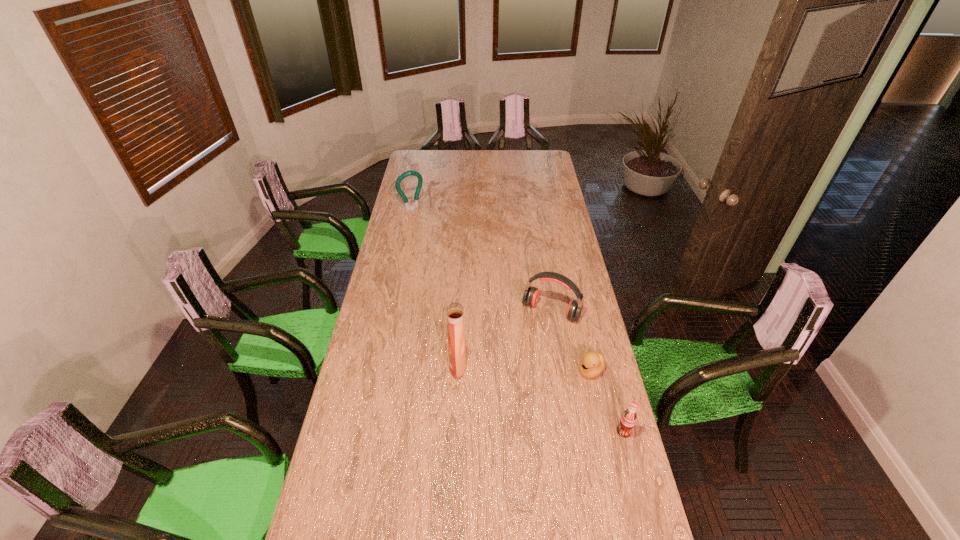
This screenshot has height=540, width=960. I want to click on vacant point located 0.310m on the front-facing side of the fourth object from right to left, so click(x=365, y=364).

The image size is (960, 540). I want to click on vacant space located 0.350m on the front-facing side of the fourth object from right to left, so click(354, 364).

At what (x,y) coordinates should I click in order to perform the action: click on free point located 0.170m on the front of the nearest object. Please return your answer as a coordinate pair (x, y). This screenshot has height=540, width=960. Looking at the image, I should click on (639, 492).

This screenshot has width=960, height=540. Identify the location of vacant space located on the ear cups of the second farthest object. (534, 337).

Find the location of a particular element. Image resolution: width=960 pixels, height=540 pixels. vacant space situated 0.190m on the ear cups of the second farthest object is located at coordinates (522, 359).

Locate an element on the screen. The width and height of the screenshot is (960, 540). vacant space located 0.370m on the ear cups of the second farthest object is located at coordinates (502, 397).

At what (x,y) coordinates should I click in order to perform the action: click on free region located facing forward on the shortest object. Please return your answer as a coordinate pair (x, y). Image resolution: width=960 pixels, height=540 pixels. Looking at the image, I should click on (564, 394).

Where is `vacant area situated 0.190m facing forward on the shortest object`? vacant area situated 0.190m facing forward on the shortest object is located at coordinates (548, 410).

This screenshot has width=960, height=540. Identify the location of vacant space located 0.220m facing forward on the shortest object. (542, 416).

The image size is (960, 540). I want to click on free location located at the jaws of the leftmost object, so click(x=431, y=231).